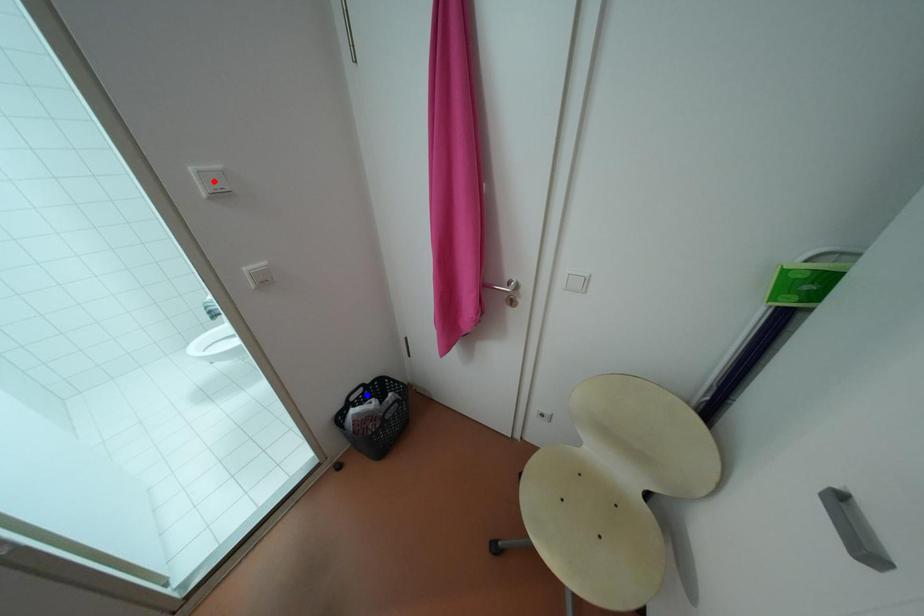
Question: Which of the two points in the image is closer to the camera?

Choices:
 (A) Blue point is closer.
 (B) Red point is closer.

Answer: (B)